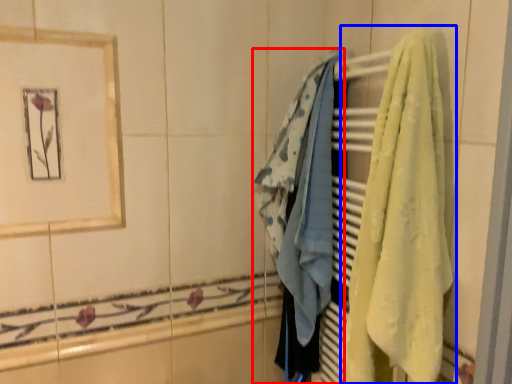
Question: Which object appears closest to the camera in this image, towel (highlighted by a red box) or towel (highlighted by a blue box)?

Choices:
 (A) towel
 (B) towel

Answer: (B)